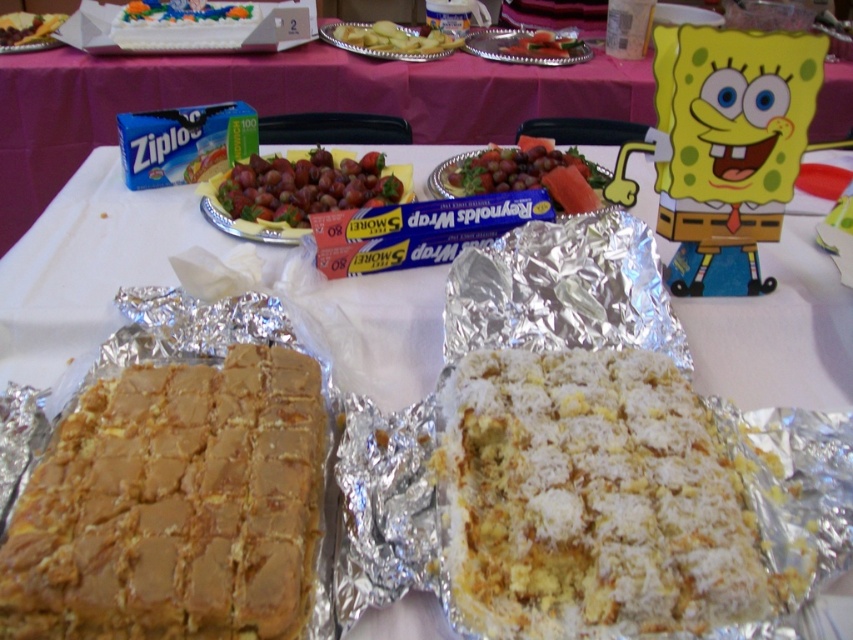
From the picture: You are a guest at the party and want to choose the larger item between the white crumbly cake at center and the shiny purple grapes at center. Which one should you pick?

The shiny purple grapes at center are larger than the white crumbly cake at center, so you should pick the shiny purple grapes at center.

Based on the photo, you are a guest at the party and want to grab some shiny purple grapes at center. Where should you look on the table?

The shiny purple grapes at center are located at the coordinates point [305,186] on the table.

You are holding a 16 inch long ruler and want to measure the distance from the camera to the point at coordinates point (634, 536). Can you reach it with your ruler?

The point at coordinates point (634, 536) is 17.37 inches away from the camera, so the 16 inch ruler is too short to reach it.